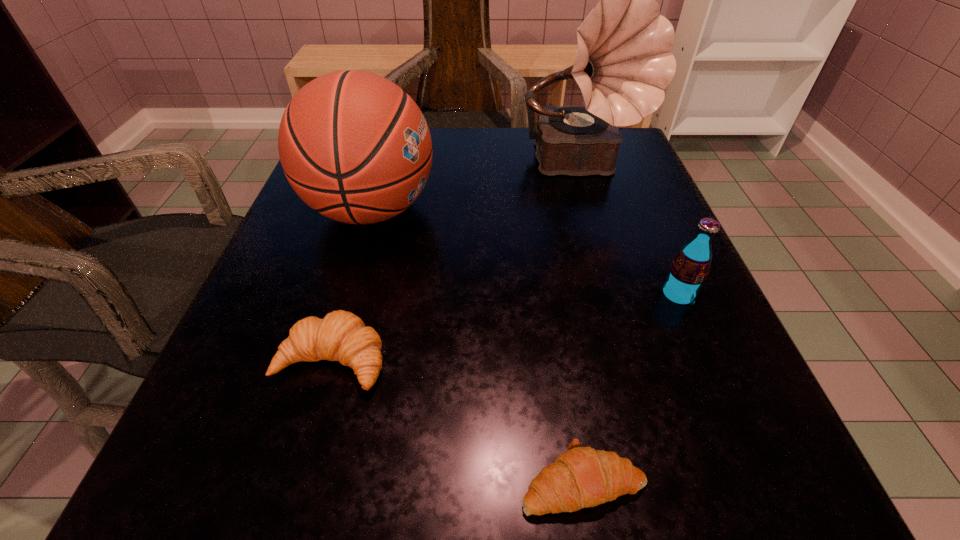
Image resolution: width=960 pixels, height=540 pixels. What are the coordinates of `blank area located 0.070m on the left of the third shortest object` in the screenshot? It's located at (611, 295).

You are a GUI agent. You are given a task and a screenshot of the screen. Output one action in this format:
    pyautogui.click(x=<x>, y=<y>)
    Task: Click on the vacant space situated 0.090m on the front of the left crescent roll
    The width and height of the screenshot is (960, 540).
    Given the screenshot: What is the action you would take?
    pyautogui.click(x=302, y=467)

The width and height of the screenshot is (960, 540). What are the coordinates of `vacant space positioned 0.210m on the back of the nearest object` in the screenshot? It's located at (556, 312).

Identify the location of record player that is at the far edge. (623, 63).

Locate an element on the screen. basketball present at the far edge is located at coordinates (354, 146).

Find the location of a particular element. Image resolution: width=960 pixels, height=540 pixels. object that is at the near edge is located at coordinates (581, 477).

You are a GUI agent. You are given a task and a screenshot of the screen. Output one action in this format:
    pyautogui.click(x=<x>, y=<y>)
    Task: Click on the basketball present at the left edge
    Image resolution: width=960 pixels, height=540 pixels.
    Given the screenshot: What is the action you would take?
    pyautogui.click(x=354, y=146)

The width and height of the screenshot is (960, 540). I want to click on crescent roll present at the left edge, so pyautogui.click(x=341, y=336).

Find the location of a particular element. record player located at the right edge is located at coordinates (623, 63).

Find the location of `soda that is positioned at the right edge`. soda that is positioned at the right edge is located at coordinates (689, 270).